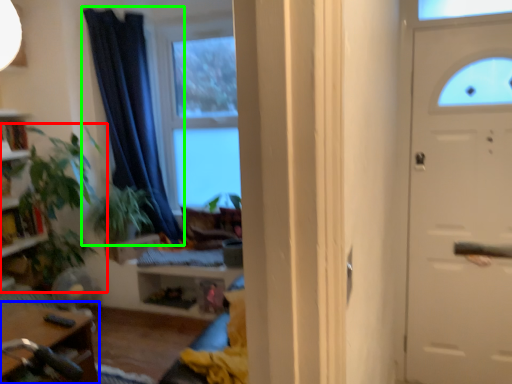
Question: Considering the real-world distances, which object is closest to houseplant (highlighted by a red box)? table (highlighted by a blue box) or curtain (highlighted by a green box).

Choices:
 (A) table
 (B) curtain

Answer: (B)